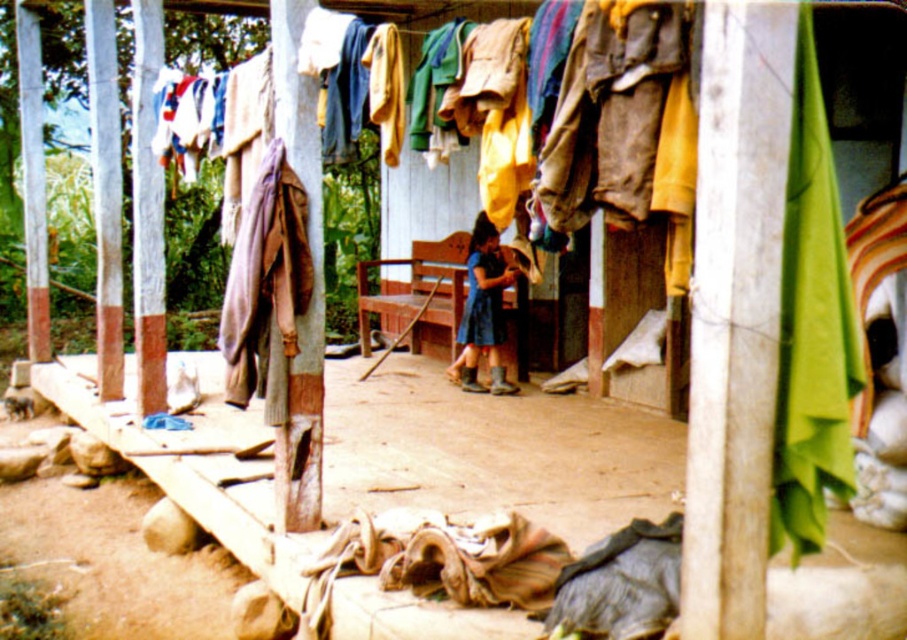
Question: Is knitted wool sweater at center below blue fabric dress at center?

Choices:
 (A) yes
 (B) no

Answer: (A)

Question: Based on their relative distances, which object is farther from the blue fabric dress at center?

Choices:
 (A) blue denim dress at center
 (B) knitted wool sweater at center

Answer: (B)

Question: Which of the following is the closest to the observer?

Choices:
 (A) (457, 324)
 (B) (268, 321)

Answer: (B)

Question: Is knitted wool sweater at center to the right of blue fabric dress at center from the viewer's perspective?

Choices:
 (A) no
 (B) yes

Answer: (A)

Question: Which of the following is the farthest from the observer?

Choices:
 (A) blue denim dress at center
 (B) blue fabric dress at center

Answer: (B)

Question: Is knitted wool sweater at center to the left of blue fabric dress at center from the viewer's perspective?

Choices:
 (A) no
 (B) yes

Answer: (B)